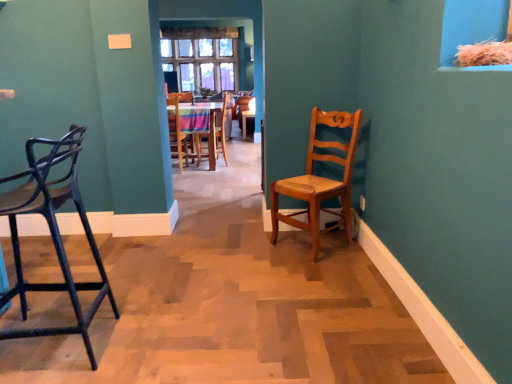
At what (x,y) coordinates should I click in order to perform the action: click on free location to the right of matte black stool at left, the 5th chair viewed from the back. Please return your answer as a coordinate pair (x, y). This screenshot has width=512, height=384. Looking at the image, I should click on (162, 331).